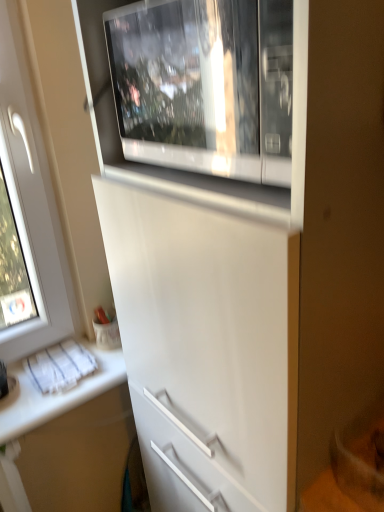
Question: From the image's perspective, is white glossy countertop at lower left located above white glossy microwave at upper center?

Choices:
 (A) yes
 (B) no

Answer: (B)

Question: Can you confirm if white glossy countertop at lower left is smaller than white glossy microwave at upper center?

Choices:
 (A) yes
 (B) no

Answer: (A)

Question: Considering the relative sizes of white glossy countertop at lower left and white glossy microwave at upper center in the image provided, is white glossy countertop at lower left taller than white glossy microwave at upper center?

Choices:
 (A) no
 (B) yes

Answer: (A)

Question: Is white glossy countertop at lower left behind white glossy microwave at upper center?

Choices:
 (A) yes
 (B) no

Answer: (A)

Question: Considering the relative sizes of white glossy countertop at lower left and white glossy microwave at upper center in the image provided, is white glossy countertop at lower left wider than white glossy microwave at upper center?

Choices:
 (A) no
 (B) yes

Answer: (B)

Question: Can you confirm if white glossy countertop at lower left is thinner than white glossy microwave at upper center?

Choices:
 (A) no
 (B) yes

Answer: (A)

Question: Is the position of white glossy microwave at upper center more distant than that of white glossy countertop at lower left?

Choices:
 (A) no
 (B) yes

Answer: (A)

Question: Is white glossy microwave at upper center next to white glossy countertop at lower left and touching it?

Choices:
 (A) no
 (B) yes

Answer: (A)

Question: Is white glossy microwave at upper center bigger than white glossy countertop at lower left?

Choices:
 (A) no
 (B) yes

Answer: (B)

Question: Is white glossy microwave at upper center turned away from white glossy countertop at lower left?

Choices:
 (A) yes
 (B) no

Answer: (B)

Question: Is white glossy microwave at upper center completely or partially outside of white glossy countertop at lower left?

Choices:
 (A) yes
 (B) no

Answer: (A)

Question: From the image's perspective, is white glossy microwave at upper center over white glossy countertop at lower left?

Choices:
 (A) no
 (B) yes

Answer: (B)

Question: Is white glossy countertop at lower left bigger or smaller than white glossy microwave at upper center?

Choices:
 (A) big
 (B) small

Answer: (B)